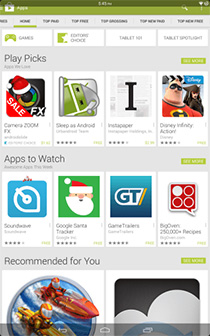
Where is `game controller`? The image size is (210, 336). game controller is located at coordinates (13, 37).